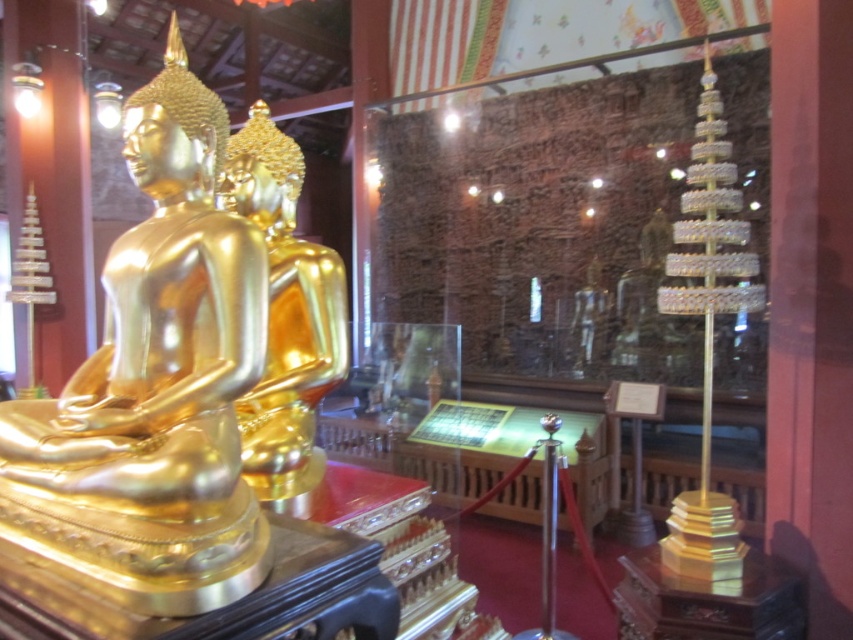
Question: Does gold shiny statue at left have a smaller size compared to gold shiny statue at center?

Choices:
 (A) yes
 (B) no

Answer: (A)

Question: Can you confirm if gold shiny statue at left is positioned below gold shiny statue at center?

Choices:
 (A) no
 (B) yes

Answer: (B)

Question: Which point is closer to the camera?

Choices:
 (A) gold shiny statue at center
 (B) gold shiny statue at left

Answer: (B)

Question: Can you confirm if gold shiny statue at left is positioned above gold shiny statue at center?

Choices:
 (A) no
 (B) yes

Answer: (A)

Question: Which point is closer to the camera taking this photo?

Choices:
 (A) (231, 138)
 (B) (132, 550)

Answer: (B)